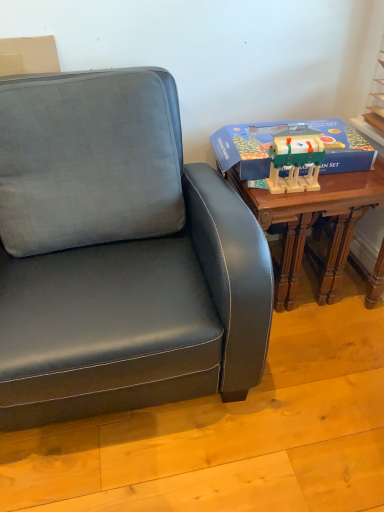
Question: Can you confirm if wooden christmas train set at right is positioned to the left of wooden table at right?

Choices:
 (A) yes
 (B) no

Answer: (A)

Question: Is the position of wooden christmas train set at right less distant than that of wooden table at right?

Choices:
 (A) no
 (B) yes

Answer: (B)

Question: Does wooden christmas train set at right have a greater height compared to wooden table at right?

Choices:
 (A) yes
 (B) no

Answer: (B)

Question: Could you tell me if wooden christmas train set at right is facing wooden table at right?

Choices:
 (A) yes
 (B) no

Answer: (B)

Question: Considering the relative sizes of wooden christmas train set at right and wooden table at right in the image provided, is wooden christmas train set at right thinner than wooden table at right?

Choices:
 (A) yes
 (B) no

Answer: (A)

Question: Is wooden christmas train set at right bigger or smaller than wooden table at right?

Choices:
 (A) big
 (B) small

Answer: (B)

Question: Looking at their shapes, would you say wooden christmas train set at right is wider or thinner than wooden table at right?

Choices:
 (A) thin
 (B) wide

Answer: (A)

Question: From a real-world perspective, is wooden christmas train set at right physically located above or below wooden table at right?

Choices:
 (A) above
 (B) below

Answer: (A)

Question: Is wooden christmas train set at right inside the boundaries of wooden table at right, or outside?

Choices:
 (A) outside
 (B) inside

Answer: (A)

Question: Based on their positions, is wooden table at right located to the left or right of wooden christmas train set at right?

Choices:
 (A) left
 (B) right

Answer: (B)

Question: In terms of width, does wooden table at right look wider or thinner when compared to wooden christmas train set at right?

Choices:
 (A) wide
 (B) thin

Answer: (A)

Question: From a real-world perspective, relative to wooden christmas train set at right, is wooden table at right vertically above or below?

Choices:
 (A) below
 (B) above

Answer: (A)

Question: Relative to wooden christmas train set at right, is wooden table at right in front or behind?

Choices:
 (A) front
 (B) behind

Answer: (B)

Question: Looking at the image, does blue cardboard box at right seem bigger or smaller compared to wooden table at right?

Choices:
 (A) small
 (B) big

Answer: (A)

Question: Looking at their shapes, would you say blue cardboard box at right is wider or thinner than wooden table at right?

Choices:
 (A) thin
 (B) wide

Answer: (A)